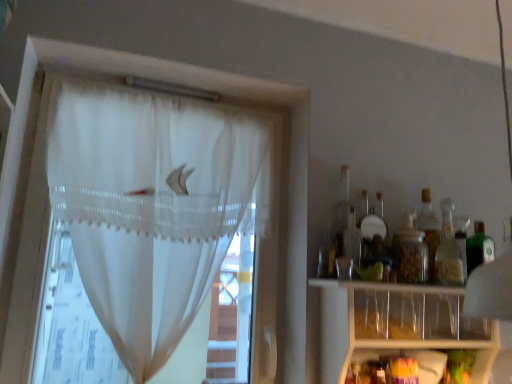
Question: Considering the relative positions of transparent glass jar at right, the second bottle positioned from the right, and translucent glass bottle at right, acting as the second bottle starting from the left, in the image provided, is transparent glass jar at right, the second bottle positioned from the right, behind translucent glass bottle at right, acting as the second bottle starting from the left,?

Choices:
 (A) yes
 (B) no

Answer: (B)

Question: Does transparent glass jar at right, the second bottle positioned from the right, contain translucent glass bottle at right, acting as the second bottle starting from the left?

Choices:
 (A) no
 (B) yes

Answer: (A)

Question: Is transparent glass jar at right, the second bottle positioned from the right, positioned beyond the bounds of translucent glass bottle at right, positioned as the 1th bottle in right-to-left order?

Choices:
 (A) yes
 (B) no

Answer: (A)

Question: From a real-world perspective, is transparent glass jar at right, the second bottle positioned from the right, on translucent glass bottle at right, positioned as the 1th bottle in right-to-left order?

Choices:
 (A) no
 (B) yes

Answer: (A)

Question: From a real-world perspective, is transparent glass jar at right, the first bottle in the left-to-right sequence, below translucent glass bottle at right, positioned as the 1th bottle in right-to-left order?

Choices:
 (A) yes
 (B) no

Answer: (A)

Question: Based on their sizes in the image, would you say transparent glass jar at right, the second bottle positioned from the right, is bigger or smaller than clear plastic shelf at lower right?

Choices:
 (A) small
 (B) big

Answer: (A)

Question: From the image's perspective, is transparent glass jar at right, the first bottle in the left-to-right sequence, positioned above or below clear plastic shelf at lower right?

Choices:
 (A) above
 (B) below

Answer: (A)

Question: Is transparent glass jar at right, the first bottle in the left-to-right sequence, inside the boundaries of clear plastic shelf at lower right, or outside?

Choices:
 (A) inside
 (B) outside

Answer: (B)

Question: Considering their positions, is transparent glass jar at right, the first bottle in the left-to-right sequence, located in front of or behind clear plastic shelf at lower right?

Choices:
 (A) front
 (B) behind

Answer: (B)

Question: From a real-world perspective, is clear plastic shelf at lower right physically located above or below transparent glass jar at right, the second bottle positioned from the right?

Choices:
 (A) above
 (B) below

Answer: (B)

Question: In the image, is clear plastic shelf at lower right on the left side or the right side of transparent glass jar at right, the first bottle in the left-to-right sequence?

Choices:
 (A) right
 (B) left

Answer: (A)

Question: From the image's perspective, is clear plastic shelf at lower right located above or below transparent glass jar at right, the second bottle positioned from the right?

Choices:
 (A) above
 (B) below

Answer: (B)

Question: Considering the positions of clear plastic shelf at lower right and transparent glass jar at right, the second bottle positioned from the right, in the image, is clear plastic shelf at lower right bigger or smaller than transparent glass jar at right, the second bottle positioned from the right,?

Choices:
 (A) big
 (B) small

Answer: (A)

Question: Would you say translucent glass bottle at right, positioned as the 1th bottle in right-to-left order, is to the left or to the right of white sheer curtain at left in the picture?

Choices:
 (A) left
 (B) right

Answer: (B)

Question: Is translucent glass bottle at right, acting as the second bottle starting from the left, taller or shorter than white sheer curtain at left?

Choices:
 (A) short
 (B) tall

Answer: (A)